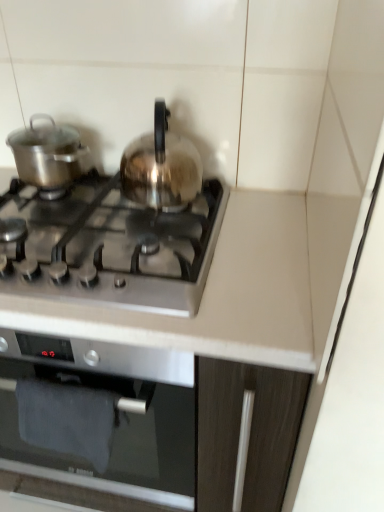
Question: Is the depth of satin silver gas stove at center less than that of shiny silver pot at left, acting as the second kitchen appliance starting from the right?

Choices:
 (A) no
 (B) yes

Answer: (B)

Question: Is satin silver gas stove at center next to shiny silver pot at left, the first kitchen appliance when ordered from left to right, and touching it?

Choices:
 (A) no
 (B) yes

Answer: (A)

Question: Considering the relative sizes of satin silver gas stove at center and shiny silver pot at left, the first kitchen appliance when ordered from left to right, in the image provided, is satin silver gas stove at center thinner than shiny silver pot at left, the first kitchen appliance when ordered from left to right,?

Choices:
 (A) no
 (B) yes

Answer: (A)

Question: Is satin silver gas stove at center surrounding shiny silver pot at left, acting as the second kitchen appliance starting from the right?

Choices:
 (A) yes
 (B) no

Answer: (B)

Question: From the image's perspective, is satin silver gas stove at center on top of shiny silver pot at left, the first kitchen appliance when ordered from left to right?

Choices:
 (A) no
 (B) yes

Answer: (A)

Question: From a real-world perspective, relative to satin silver gas stove at center, is shiny silver pot at left, the first kitchen appliance when ordered from left to right, vertically above or below?

Choices:
 (A) below
 (B) above

Answer: (B)

Question: Is shiny silver pot at left, acting as the second kitchen appliance starting from the right, wider or thinner than satin silver gas stove at center?

Choices:
 (A) wide
 (B) thin

Answer: (B)

Question: Considering the positions of point (48, 142) and point (9, 252), is point (48, 142) closer or farther from the camera than point (9, 252)?

Choices:
 (A) closer
 (B) farther

Answer: (B)

Question: Is shiny silver pot at left, acting as the second kitchen appliance starting from the right, taller or shorter than satin silver gas stove at center?

Choices:
 (A) short
 (B) tall

Answer: (B)

Question: Relative to shiny silver pot at left, the first kitchen appliance when ordered from left to right, is satin silver gas stove at center in front or behind?

Choices:
 (A) front
 (B) behind

Answer: (A)

Question: Which is correct: satin silver gas stove at center is inside shiny silver pot at left, acting as the second kitchen appliance starting from the right, or outside of it?

Choices:
 (A) outside
 (B) inside

Answer: (A)

Question: In the image, is satin silver gas stove at center on the left side or the right side of shiny silver pot at left, acting as the second kitchen appliance starting from the right?

Choices:
 (A) left
 (B) right

Answer: (B)

Question: In terms of width, does satin silver gas stove at center look wider or thinner when compared to shiny silver pot at left, acting as the second kitchen appliance starting from the right?

Choices:
 (A) wide
 (B) thin

Answer: (A)

Question: In terms of size, does satin silver kettle at center, the second kitchen appliance when ordered from left to right, appear bigger or smaller than satin silver gas stove at center?

Choices:
 (A) small
 (B) big

Answer: (A)

Question: Visually, is satin silver kettle at center, the second kitchen appliance when ordered from left to right, positioned to the left or to the right of satin silver gas stove at center?

Choices:
 (A) right
 (B) left

Answer: (A)